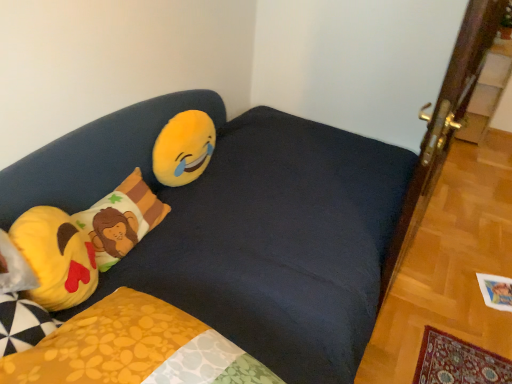
Where is `blank space situated above yellow plush emoji at left, the 2th pillow viewed from the back (from a real-world perspective)`? blank space situated above yellow plush emoji at left, the 2th pillow viewed from the back (from a real-world perspective) is located at coordinates (38, 235).